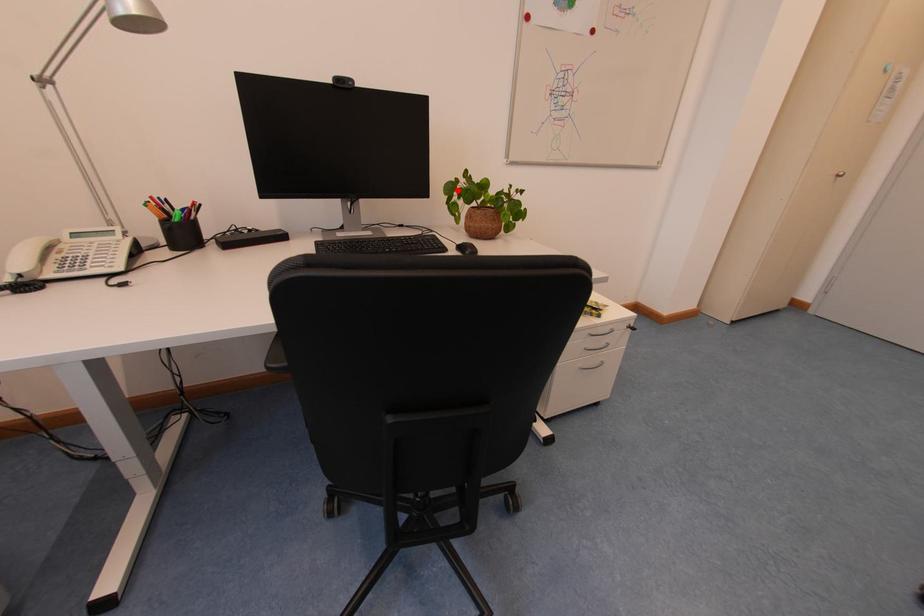
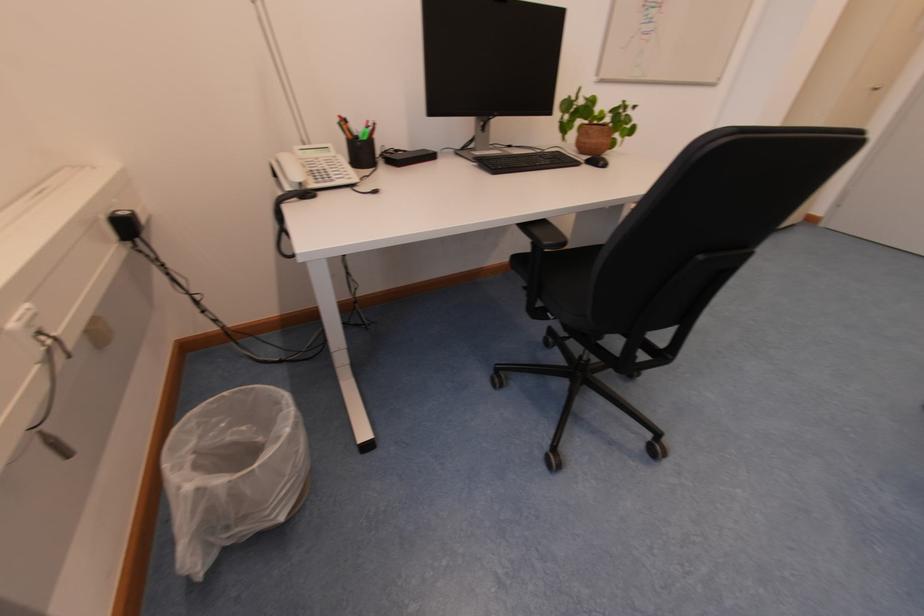
In the second image, find the point that corresponds to the highlighted location in the first image.

(575, 108)